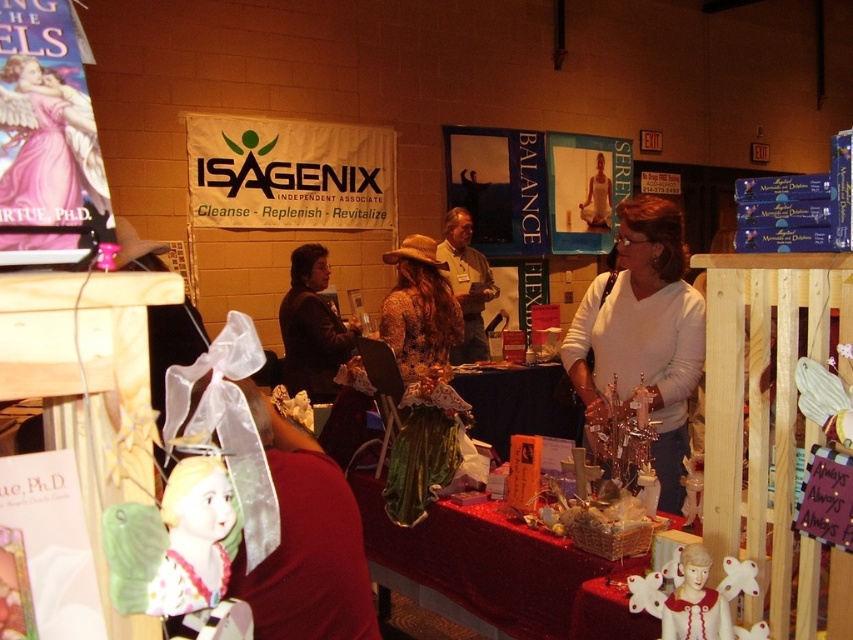
You are attending a trade show and notice two items at a booth. The items are the white porcelain angel at center and the matte brown hat at center. Which item is taller?

The matte brown hat at center is taller than the white porcelain angel at center.

What object is located at the coordinates point (695,596) in the image?

The point (695,596) corresponds to the white porcelain angel at center.

You are a photographer at the event and want to capture the white porcelain angel at center in your shot. Given that your camera has a focal length of 50mm and you are standing 3 meters away from the angel, what is the approximate size of the angel in millimeters on the camera sensor?

The white porcelain angel at center is positioned at point coordinates, but without additional information about its actual size or the camera sensor dimensions, it is not possible to accurately calculate its size on the sensor. The given data includes only the position coordinates and distance, which are insufficient for this calculation.